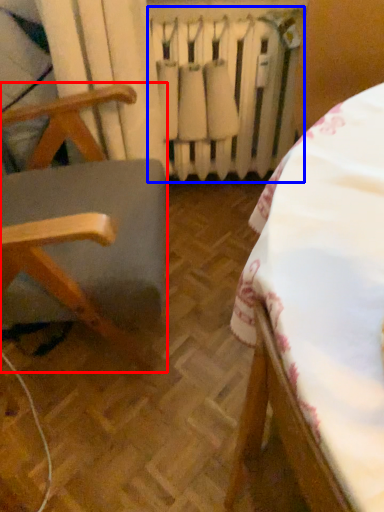
Question: Which of the following is the closest to the observer, furniture (highlighted by a red box) or radiator (highlighted by a blue box)?

Choices:
 (A) furniture
 (B) radiator

Answer: (A)